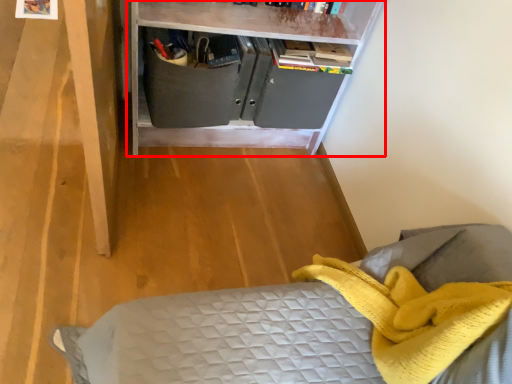
Question: From the image's perspective, where is shelf (annotated by the red box) located relative to drawer?

Choices:
 (A) above
 (B) below

Answer: (A)